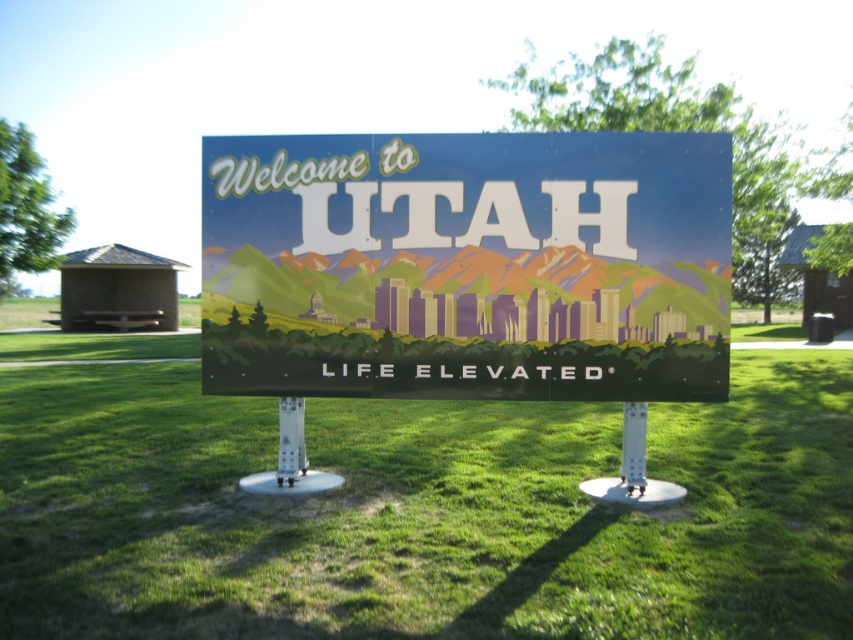
Which is below, matte plastic sign at center or white plastic pole at center?

white plastic pole at center is lower down.

Can you confirm if matte plastic sign at center is positioned below white plastic pole at center?

No, matte plastic sign at center is not below white plastic pole at center.

Image resolution: width=853 pixels, height=640 pixels. Describe the element at coordinates (467, 266) in the screenshot. I see `matte plastic sign at center` at that location.

At what (x,y) coordinates should I click in order to perform the action: click on matte plastic sign at center. Please return your answer as a coordinate pair (x, y). This screenshot has width=853, height=640. Looking at the image, I should click on (467, 266).

Who is shorter, green grass at center or matte plastic sign at center?

With less height is green grass at center.

Does point (781, 484) lie in front of point (401, 332)?

No, (781, 484) is further to viewer.

Which is behind, point (604, 570) or point (227, 280)?

Positioned behind is point (227, 280).

Find the location of a particular element. green grass at center is located at coordinates (x=413, y=508).

Can you confirm if green grass at center is taller than white plastic pole at center?

Yes.

Who is higher up, green grass at center or white plastic pole at center?

Positioned higher is green grass at center.

Which is behind, point (675, 570) or point (631, 436)?

The point (631, 436) is behind.

Find the location of a particular element. The height and width of the screenshot is (640, 853). green grass at center is located at coordinates (413, 508).